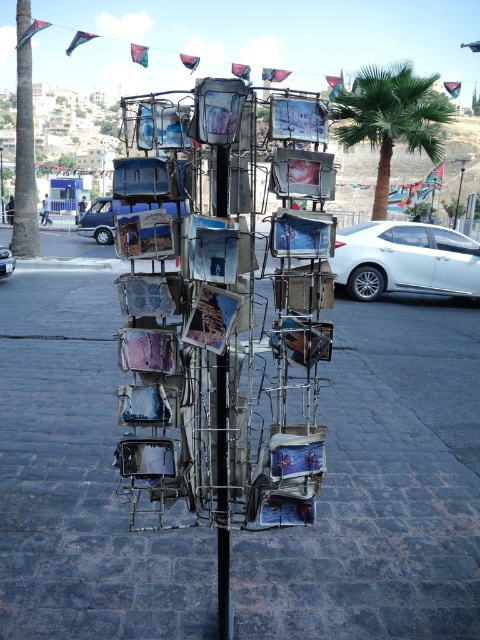
Describe the element at coordinates (391, 116) in the screenshot. I see `green leafy palm tree at center` at that location.

Is green leafy palm tree at center thinner than silver metallic car at center?

No.

Who is more forward, [369,109] or [6,269]?

Point [6,269] is in front.

Locate an element on the screen. green leafy palm tree at center is located at coordinates (391, 116).

Which is more to the right, silver metallic car at center or metallic photo frames at center?

Positioned to the right is silver metallic car at center.

Is point (12, 260) positioned before point (82, 216)?

Yes, point (12, 260) is in front of point (82, 216).

Is point (1, 260) farther from camera compared to point (78, 208)?

No.

Where is `silver metallic car at center`? The image size is (480, 640). silver metallic car at center is located at coordinates (6, 260).

From the picture: Is white metallic sedan at right smaller than matte silver van at left?

Yes.

Does white metallic sedan at right have a lesser height compared to matte silver van at left?

Indeed, white metallic sedan at right has a lesser height compared to matte silver van at left.

Who is more forward, (x=359, y=285) or (x=86, y=236)?

Point (x=359, y=285) is in front.

Identify the location of white metallic sedan at right. (405, 259).